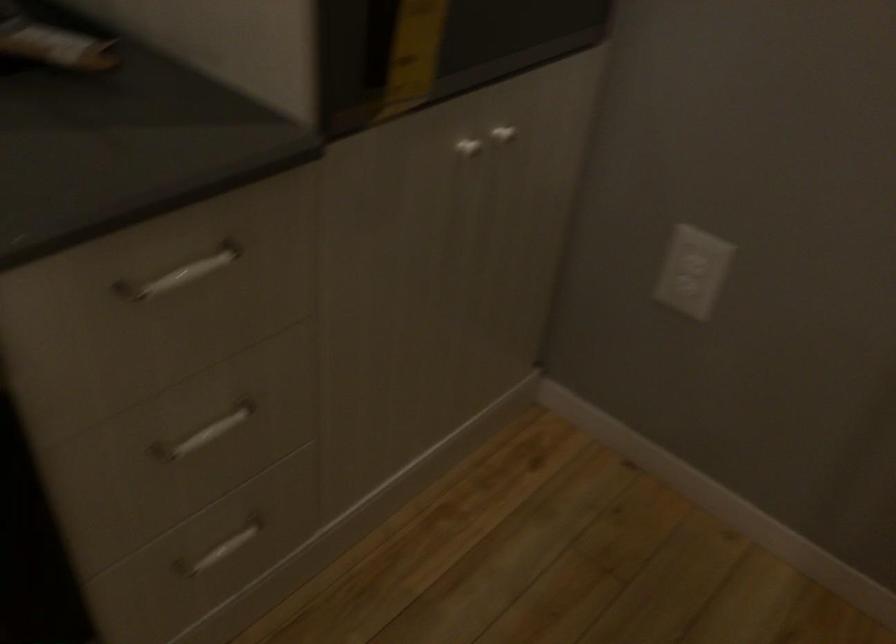
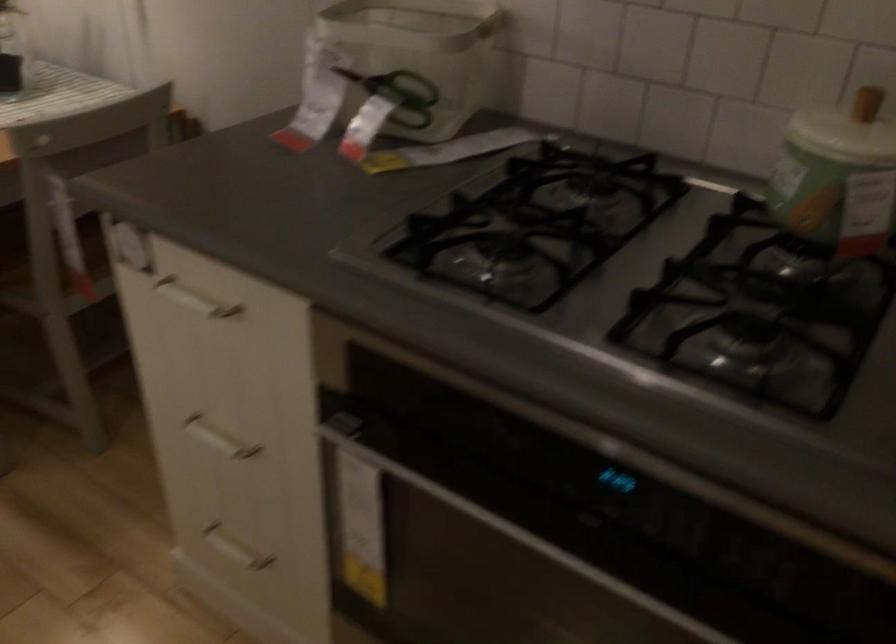
How did the camera likely rotate?

The rotation direction of the camera is left-down.